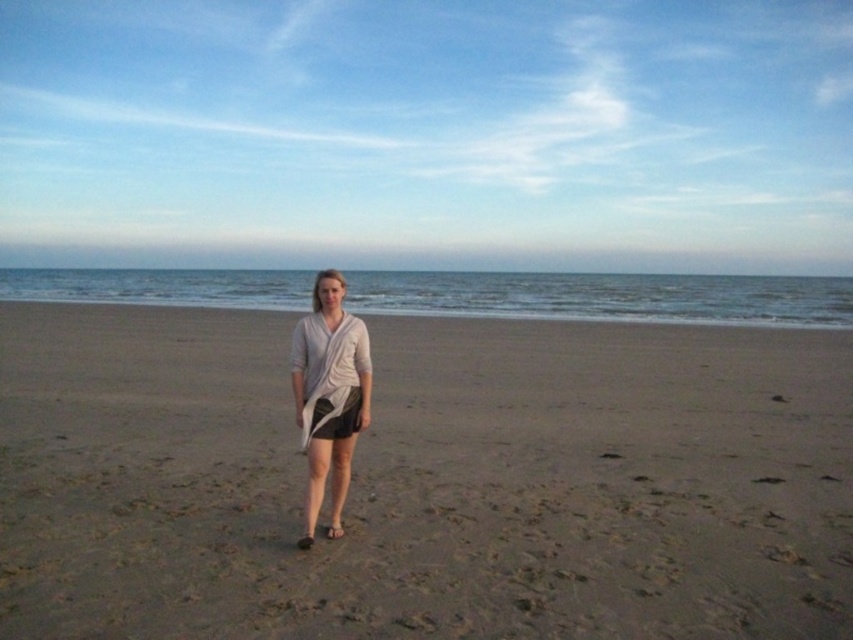
Can you confirm if brown sandy beach at center is positioned to the right of light gray draped fabric at center?

In fact, brown sandy beach at center is to the left of light gray draped fabric at center.

Is brown sandy beach at center positioned before light gray draped fabric at center?

Yes, brown sandy beach at center is in front of light gray draped fabric at center.

Where is `brown sandy beach at center`? The image size is (853, 640). brown sandy beach at center is located at coordinates (424, 481).